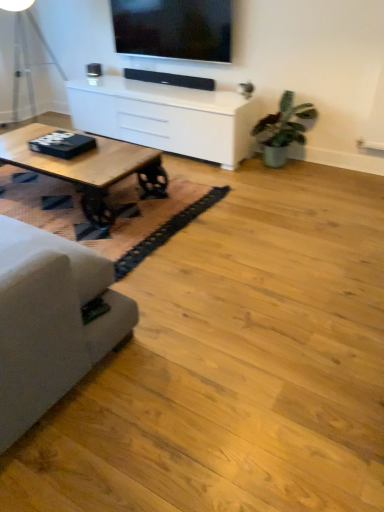
This screenshot has width=384, height=512. What are the coordinates of `vacant area to the right of suede gray couch at left` in the screenshot? It's located at (210, 371).